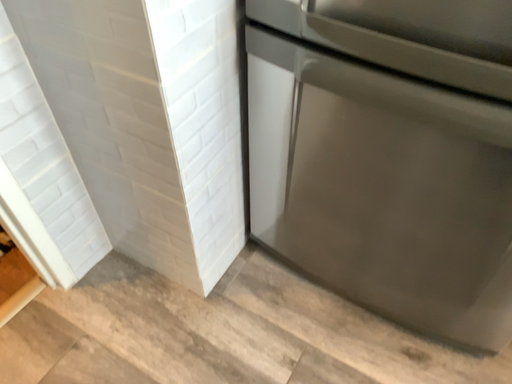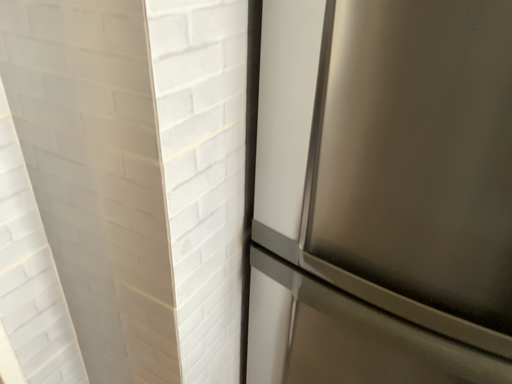
Question: Which way did the camera rotate in the video?

Choices:
 (A) rotated upward
 (B) rotated downward

Answer: (A)